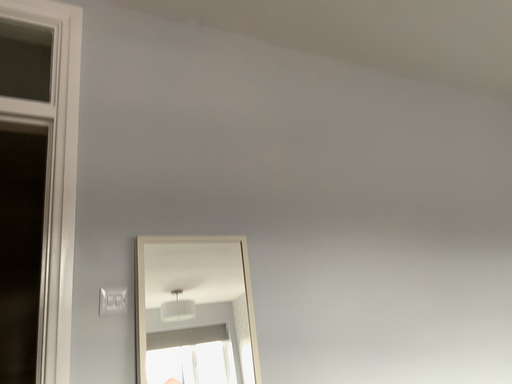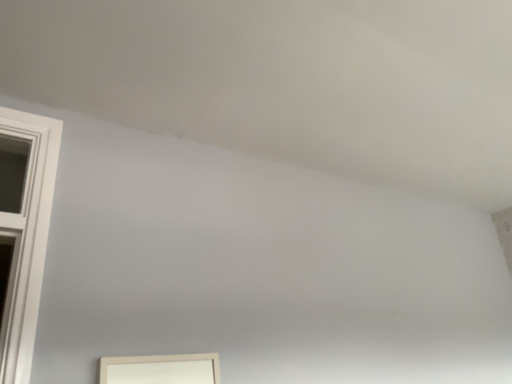
Question: How did the camera likely rotate when shooting the video?

Choices:
 (A) rotated upward
 (B) rotated downward

Answer: (A)